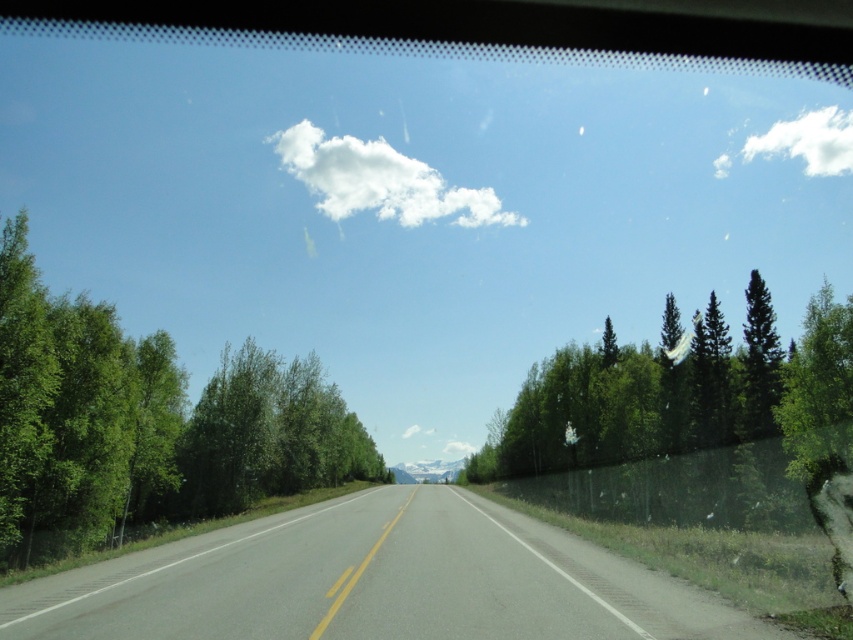
You are driving a car and looking through the windshield. You see two white fluffy clouds in the sky. Which cloud is closer to you, the white fluffy cloud at upper center or the white fluffy cloud at upper right?

The white fluffy cloud at upper center is closer to you because it is in front of the white fluffy cloud at upper right.

You are a driver approaching the asphalt road at center. There is a green leafy tree at left near the road. Can you see the tree from the driver seat? Please explain based on their positions.

Yes, the driver can see the green leafy tree at left because the asphalt road at center is below it, meaning the tree is positioned higher up relative to the road, likely within the driver s line of sight through the windshield.